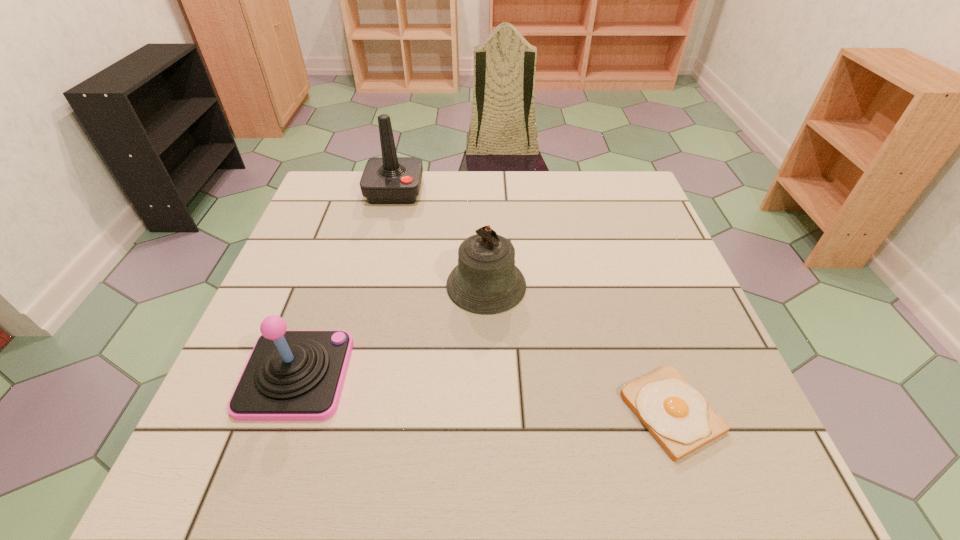
Identify the location of the farther joystick. (389, 179).

At what (x,y) coordinates should I click in order to perform the action: click on the farthest object. Please return your answer as a coordinate pair (x, y). Looking at the image, I should click on (389, 179).

Find the location of a particular element. the third nearest object is located at coordinates (486, 281).

You are a GUI agent. You are given a task and a screenshot of the screen. Output one action in this format:
    pyautogui.click(x=<x>, y=<y>)
    Task: Click on the second object from right to left
    
    Given the screenshot: What is the action you would take?
    pyautogui.click(x=486, y=281)

Where is `the nearer joystick`? This screenshot has height=540, width=960. the nearer joystick is located at coordinates (290, 375).

Identify the location of the rightmost object. (678, 416).

The image size is (960, 540). Identify the location of the shortest object. (678, 416).

I want to click on free spot located 0.110m on the right of the farthest object, so click(x=460, y=191).

Identify the location of free spot located 0.320m on the front of the second farthest object. (489, 463).

I want to click on vacant position located forward from the base of the nearer joystick, so click(x=394, y=375).